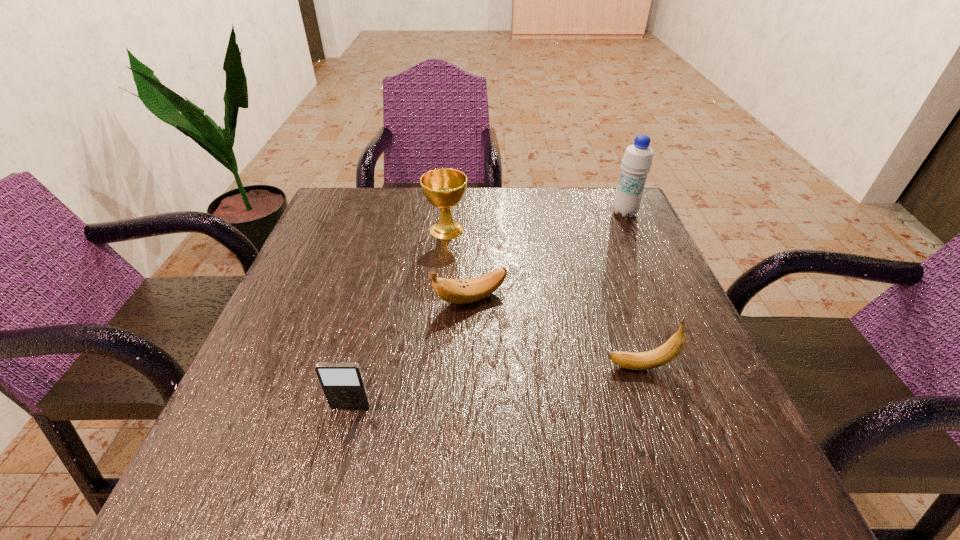
I want to click on vacant space that satisfies the following two spatial constraints: 1. at the start of the peel on the taller banana; 2. on the front-facing side of the leftmost object, so click(654, 407).

Find the location of a particular element. The height and width of the screenshot is (540, 960). vacant space that satisfies the following two spatial constraints: 1. at the start of the peel on the right banana; 2. on the front-facing side of the leftmost object is located at coordinates (654, 407).

You are a GUI agent. You are given a task and a screenshot of the screen. Output one action in this format:
    pyautogui.click(x=<x>, y=<y>)
    Task: Click on the vacant space that satisfies the following two spatial constraints: 1. at the start of the peel on the taller banana; 2. on the front-facing side of the iPod
    The height and width of the screenshot is (540, 960).
    Given the screenshot: What is the action you would take?
    pyautogui.click(x=654, y=407)

Find the location of a particular element. The image size is (960, 540). vacant area that satisfies the following two spatial constraints: 1. on the back side of the chalice; 2. on the right side of the tallest object is located at coordinates (448, 213).